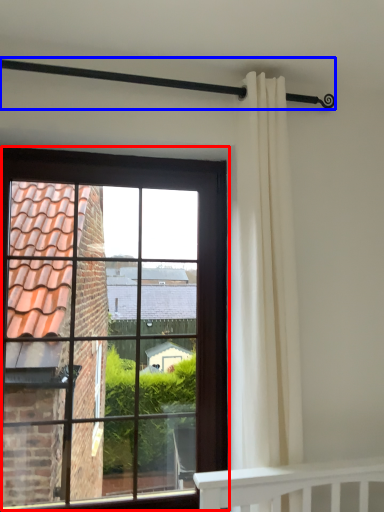
Question: Which point is further to the camera, window (highlighted by a red box) or balustrade (highlighted by a blue box)?

Choices:
 (A) window
 (B) balustrade

Answer: (A)